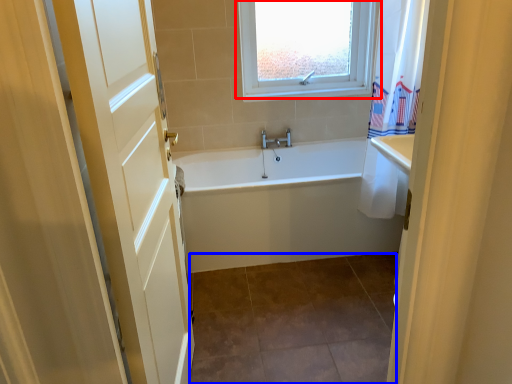
Question: Which object appears farthest to the camera in this image, window (highlighted by a red box) or tile (highlighted by a blue box)?

Choices:
 (A) window
 (B) tile

Answer: (A)